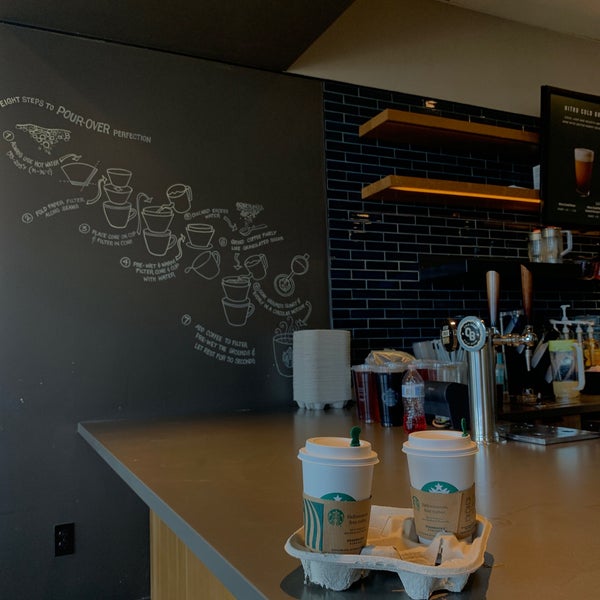
Identify the location of light black wall. (89, 324).